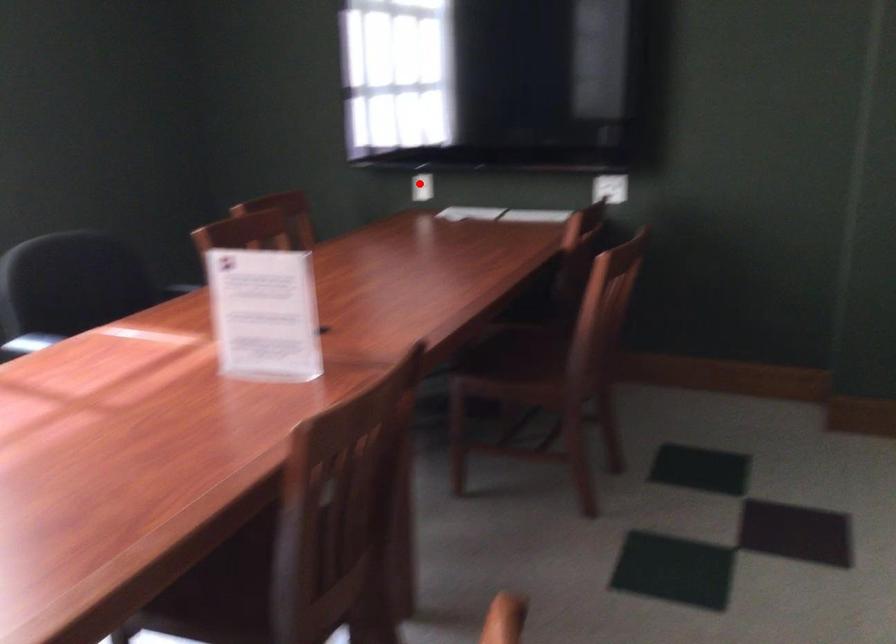
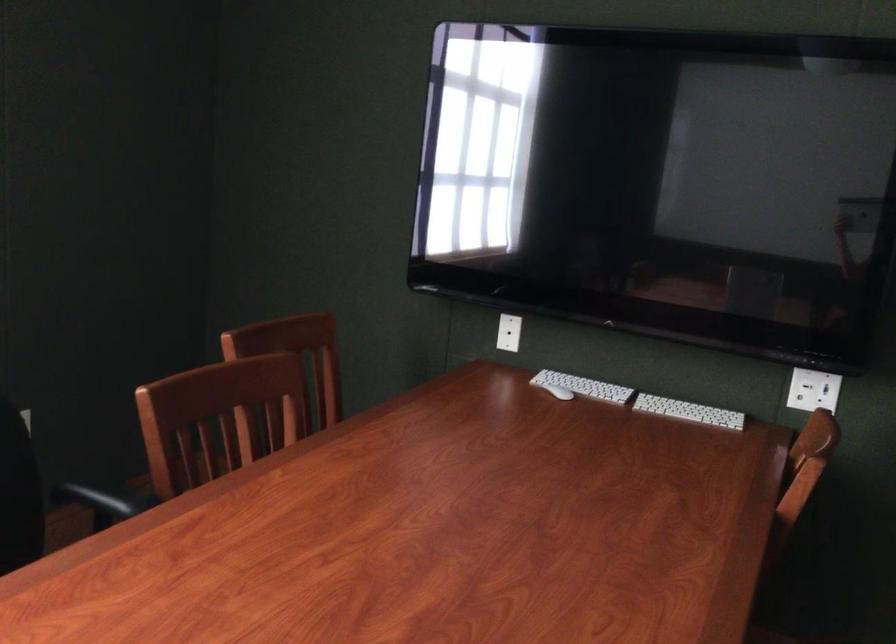
Question: A red point is marked in image1. In image2, is the corresponding 3D point closer to the camera or farther? Reply with the corresponding letter.

Choices:
 (A) The corresponding 3D point is closer.
 (B) The corresponding 3D point is farther.

Answer: (A)